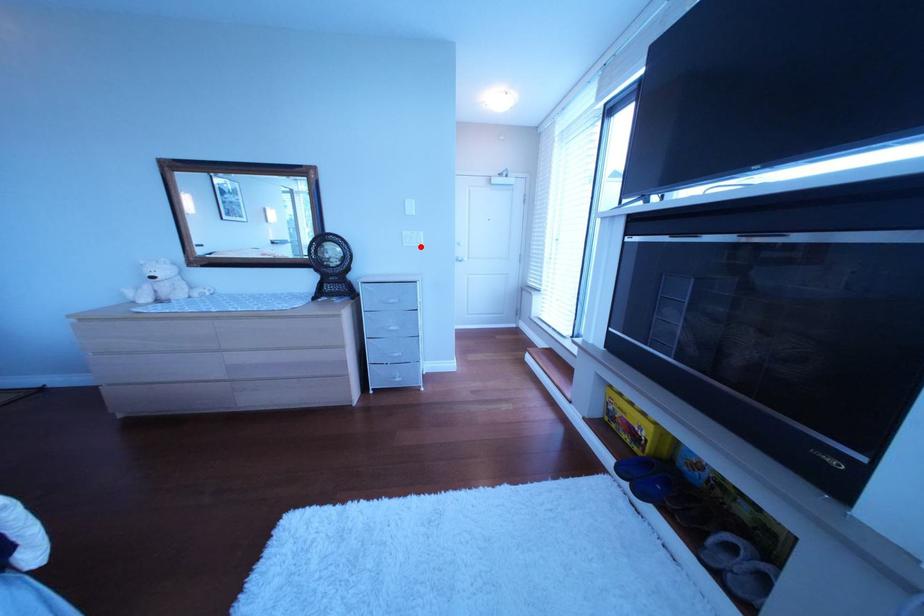
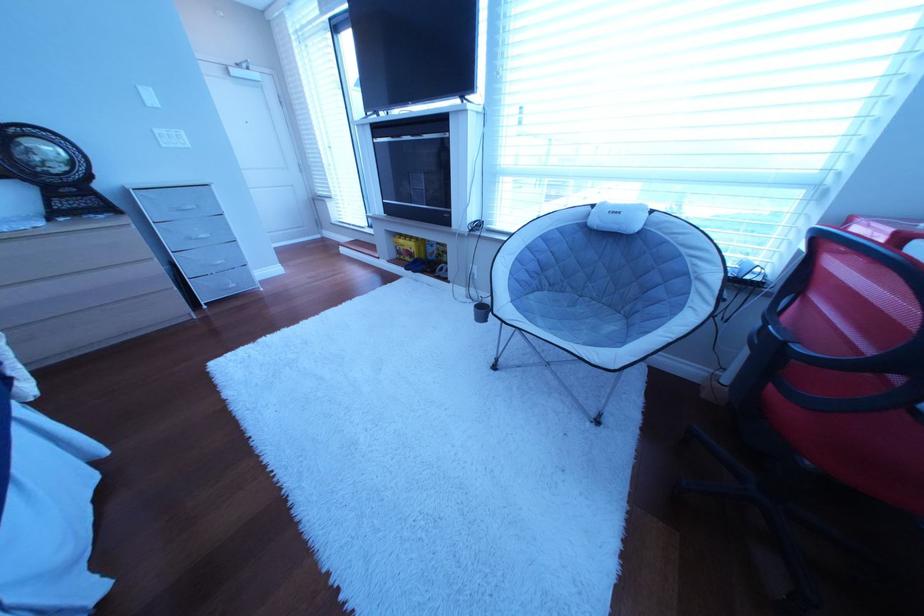
In the second image, find the point that corresponds to the highlighted location in the first image.

(179, 148)